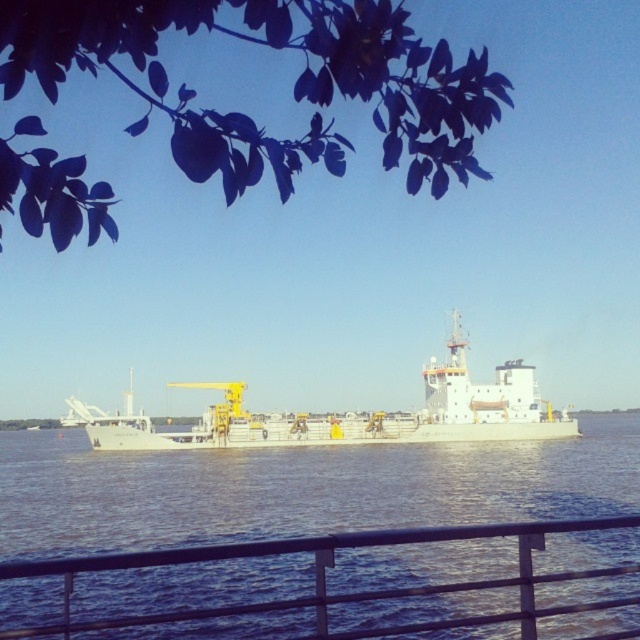
Can you confirm if white matte ship at center is positioned above metal/rail at lower center?

Indeed, white matte ship at center is positioned over metal/rail at lower center.

Who is shorter, white matte ship at center or metal/rail at lower center?

Standing shorter between the two is metal/rail at lower center.

This screenshot has height=640, width=640. Describe the element at coordinates (356, 413) in the screenshot. I see `white matte ship at center` at that location.

The width and height of the screenshot is (640, 640). In order to click on white matte ship at center in this screenshot , I will do `click(356, 413)`.

Is dark green leaves at upper left to the left of white matte ship at center from the viewer's perspective?

Yes, dark green leaves at upper left is to the left of white matte ship at center.

Does dark green leaves at upper left have a greater width compared to white matte ship at center?

No, dark green leaves at upper left is not wider than white matte ship at center.

Find the location of a particular element. The height and width of the screenshot is (640, 640). dark green leaves at upper left is located at coordinates (292, 84).

Between point (93, 22) and point (524, 588), which one is positioned behind?

The point (524, 588) is more distant.

Can you confirm if dark green leaves at upper left is positioned to the right of metal/rail at lower center?

No, dark green leaves at upper left is not to the right of metal/rail at lower center.

Image resolution: width=640 pixels, height=640 pixels. Describe the element at coordinates (292, 84) in the screenshot. I see `dark green leaves at upper left` at that location.

Identify the location of dark green leaves at upper left. [x=292, y=84].